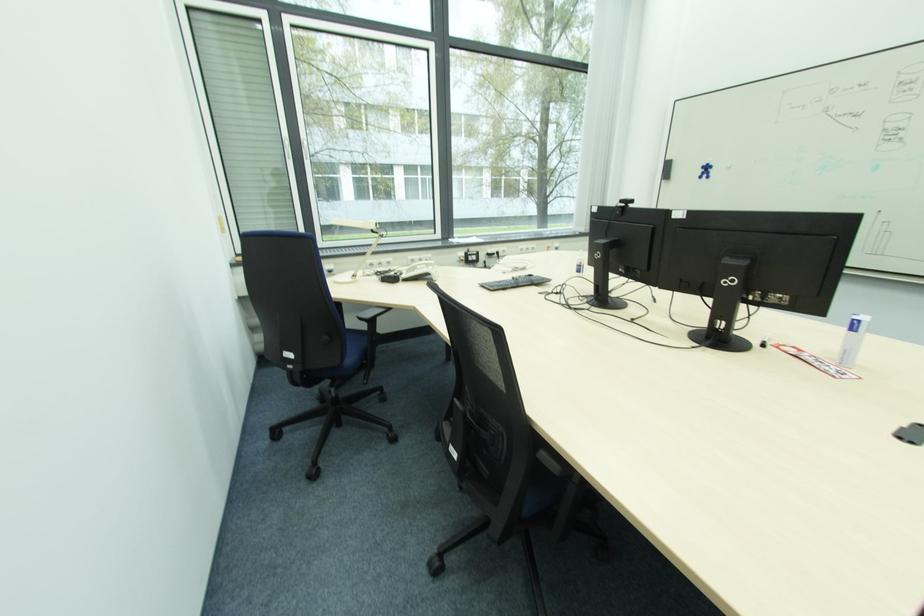
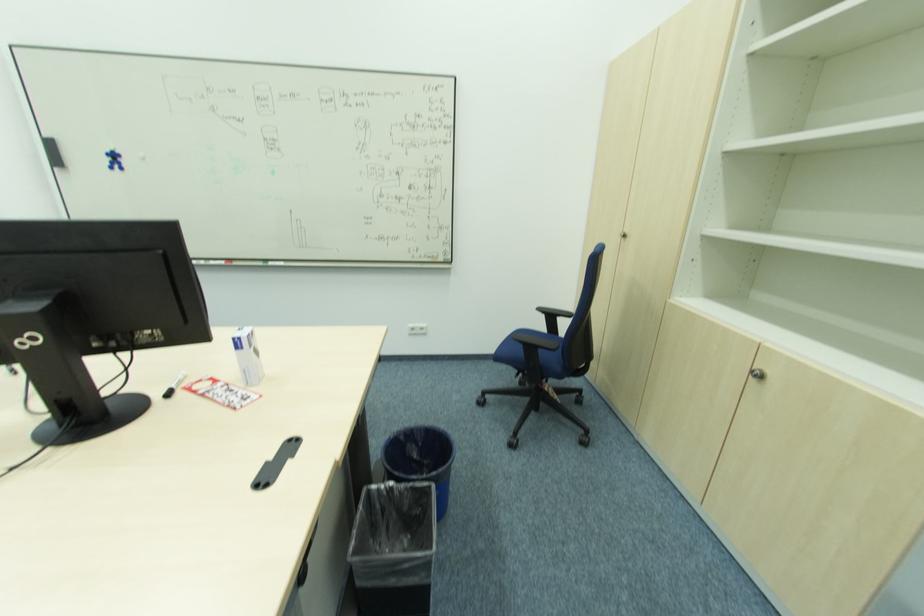
Question: Based on the continuous images, in which direction is the camera rotating? Reply with the corresponding letter.

Choices:
 (A) Left
 (B) Right
 (C) Up
 (D) Down

Answer: (B)